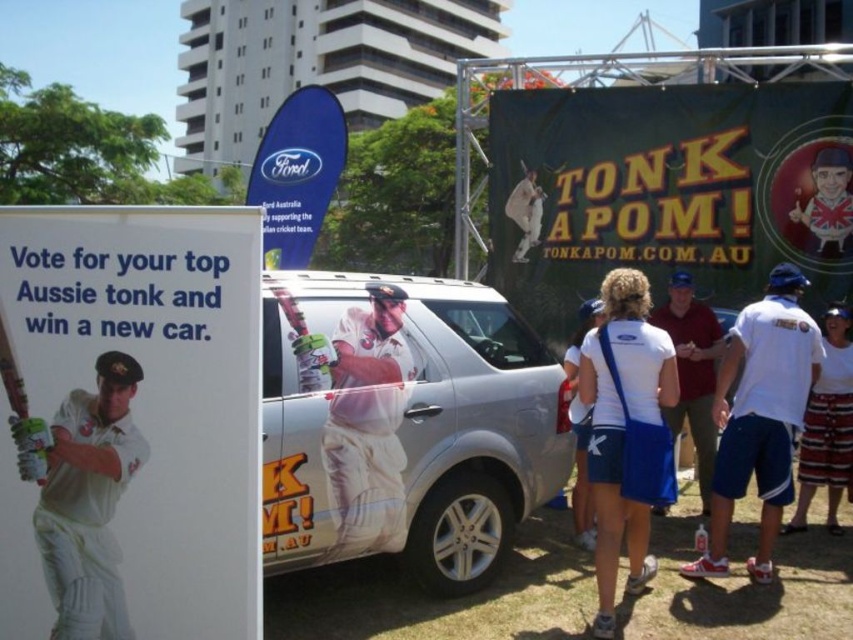
Is white matte cricket uniform at center positioned at the back of white fabric bag at center?

No, it is not.

From the picture: Can you confirm if white matte cricket uniform at center is positioned below white fabric bag at center?

No.

Where is `white matte cricket uniform at center`? The width and height of the screenshot is (853, 640). white matte cricket uniform at center is located at coordinates (90, 500).

Where is `white matte cricket uniform at center`? Image resolution: width=853 pixels, height=640 pixels. white matte cricket uniform at center is located at coordinates (90, 500).

Can you confirm if striped shorts at lower right is bigger than white fabric shorts at center?

No.

Is striped shorts at lower right to the left of white fabric shorts at center from the viewer's perspective?

No, striped shorts at lower right is not to the left of white fabric shorts at center.

This screenshot has width=853, height=640. Describe the element at coordinates (827, 424) in the screenshot. I see `striped shorts at lower right` at that location.

Identify the location of striped shorts at lower right. Image resolution: width=853 pixels, height=640 pixels. (827, 424).

Which is above, striped shorts at lower right or wooden bat at left?

wooden bat at left

Is striped shorts at lower right below wooden bat at left?

Indeed, striped shorts at lower right is positioned under wooden bat at left.

Describe the element at coordinates (827, 424) in the screenshot. This screenshot has height=640, width=853. I see `striped shorts at lower right` at that location.

Find the location of a particular element. striped shorts at lower right is located at coordinates (827, 424).